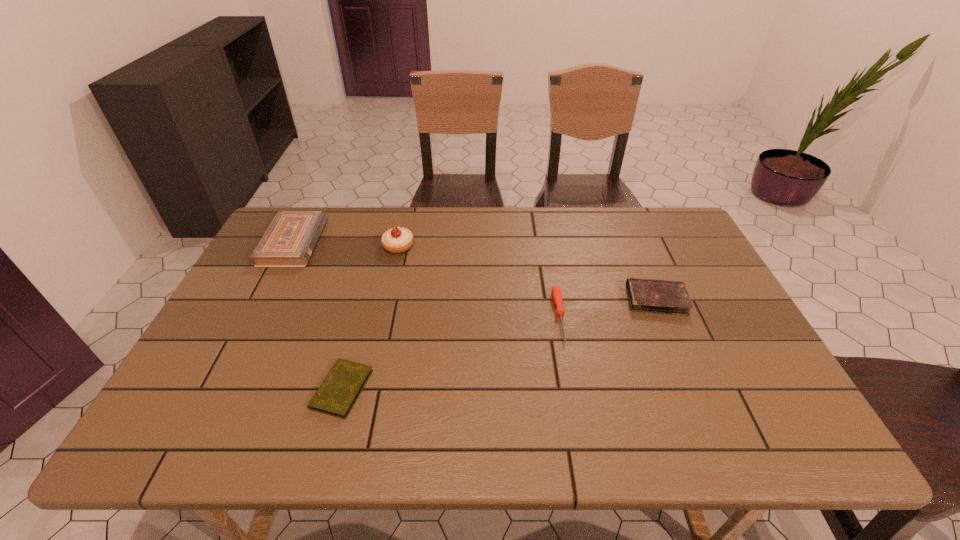
Where is `unoccupied area between the right diary and the second shortest object`? This screenshot has height=540, width=960. unoccupied area between the right diary and the second shortest object is located at coordinates (608, 308).

The image size is (960, 540). Find the location of `free point between the second object from right to left and the nearer diary`. free point between the second object from right to left and the nearer diary is located at coordinates (451, 353).

What are the coordinates of `vacant region between the nearest object and the farther diary` in the screenshot? It's located at (499, 345).

Where is `vacant space that's between the tallest object and the fourth tallest object`? This screenshot has height=540, width=960. vacant space that's between the tallest object and the fourth tallest object is located at coordinates (479, 281).

This screenshot has width=960, height=540. Find the location of `vacant area between the pastry and the left diary`. vacant area between the pastry and the left diary is located at coordinates (371, 318).

Locate an element on the screen. the closest object to the fourth object from left to right is located at coordinates (645, 295).

Identify which object is located as the fourth nearest to the leftmost object. Please provide its 2D coordinates. Your answer should be formatted as a tuple, i.e. [(x, y)], where the tuple contains the x and y coordinates of a point satisfying the conditions above.

[(645, 295)]

Identify the location of free spot that satisfies the following two spatial constraints: 1. on the spine side of the leftmost object; 2. on the left side of the rightmost object. (265, 300).

This screenshot has width=960, height=540. I want to click on free space that satisfies the following two spatial constraints: 1. on the spine side of the tallest object; 2. on the right side of the second tallest object, so click(x=292, y=246).

Find the location of `free space that satisfies the following two spatial constraints: 1. on the spine side of the third shortest object; 2. on the right side of the Bible`. free space that satisfies the following two spatial constraints: 1. on the spine side of the third shortest object; 2. on the right side of the Bible is located at coordinates (265, 300).